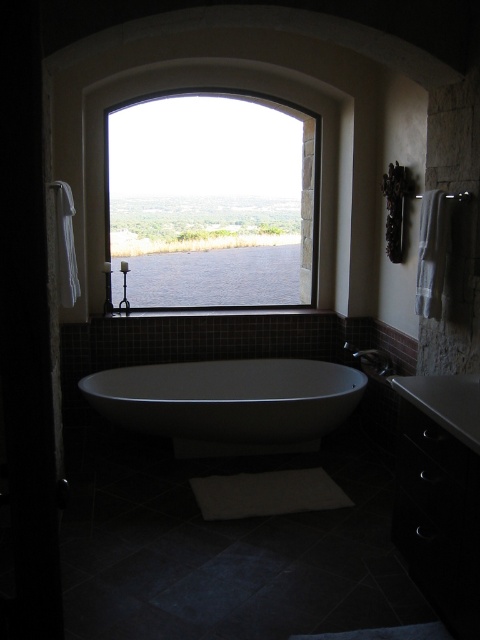
Question: Observing the image, what is the correct spatial positioning of clear glass window at upper center in reference to white glossy sink at lower right?

Choices:
 (A) above
 (B) below

Answer: (A)

Question: Which object is positioned farthest from the clear glass window at upper center?

Choices:
 (A) white glossy sink at lower right
 (B) white glossy bathtub at center

Answer: (A)

Question: Based on their relative distances, which object is farther from the white glossy sink at lower right?

Choices:
 (A) white glossy bathtub at center
 (B) clear glass window at upper center

Answer: (B)

Question: Which of the following is the farthest from the observer?

Choices:
 (A) white glossy sink at lower right
 (B) clear glass window at upper center
 (C) white glossy bathtub at center

Answer: (B)

Question: Is clear glass window at upper center bigger than white glossy bathtub at center?

Choices:
 (A) yes
 (B) no

Answer: (A)

Question: Can you confirm if clear glass window at upper center is positioned to the right of white glossy sink at lower right?

Choices:
 (A) yes
 (B) no

Answer: (B)